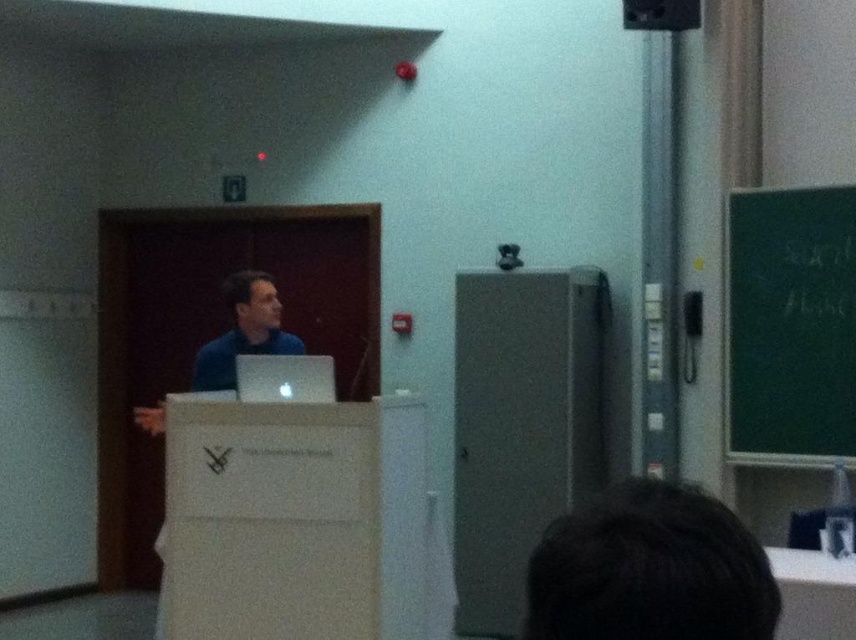
From the picture: You are a student sitting in the classroom and want to look at the green chalkboard at upper right while also checking the dark brown hair at lower center. Can you see both at the same time without moving your head?

The green chalkboard at upper right is positioned over the dark brown hair at lower center, so you can see both at the same time without moving your head because the chalkboard is above the hair.

You are an attendee in the lecture hall and want to take a photo of the green chalkboard at upper right and the dark brown hair at lower center for your notes. Which object should you focus on first if you want to capture both in one frame?

The green chalkboard at upper right is larger in size than the dark brown hair at lower center, so you should focus on the green chalkboard at upper right first to ensure it is clearly visible in the frame.